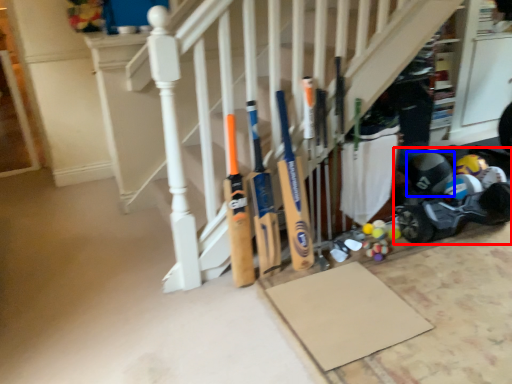
Question: Among these objects, which one is farthest to the camera, baby carriage (highlighted by a red box) or helmet (highlighted by a blue box)?

Choices:
 (A) baby carriage
 (B) helmet

Answer: (B)